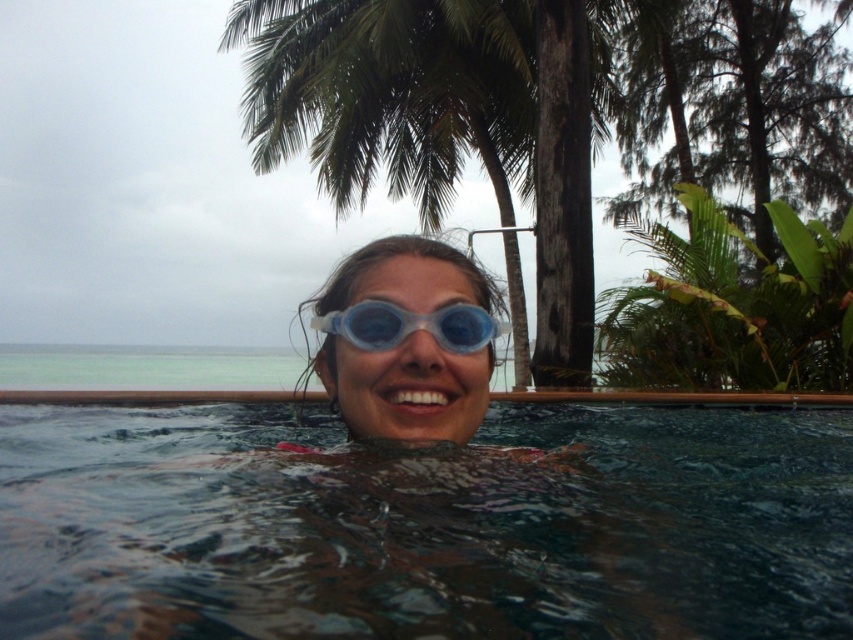
Between transparent plastic water at center and transparent blue goggles at center, which one is positioned higher?

Positioned higher is transparent blue goggles at center.

Between transparent plastic water at center and transparent blue goggles at center, which one has more height?

transparent blue goggles at center is taller.

What are the coordinates of `transparent plastic water at center` in the screenshot? It's located at (424, 528).

Where is `transparent plastic water at center`? transparent plastic water at center is located at coordinates [x=424, y=528].

Who is positioned more to the left, transparent plastic water at center or green leafy palm tree at upper center?

green leafy palm tree at upper center is more to the left.

Which is in front, point (756, 561) or point (341, 172)?

Point (756, 561) is more forward.

This screenshot has width=853, height=640. I want to click on transparent plastic water at center, so click(424, 528).

The height and width of the screenshot is (640, 853). In order to click on transparent blue goggles at center in this screenshot , I will do `click(405, 387)`.

Is transparent blue goggles at center to the left of transparent plastic goggles at center from the viewer's perspective?

Correct, you'll find transparent blue goggles at center to the left of transparent plastic goggles at center.

Does point (318, 356) lie behind point (438, 332)?

Yes.

The width and height of the screenshot is (853, 640). I want to click on transparent blue goggles at center, so click(x=405, y=387).